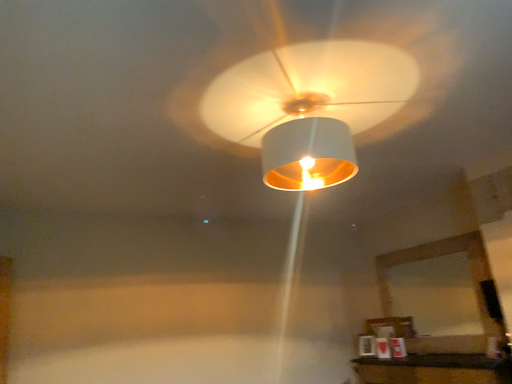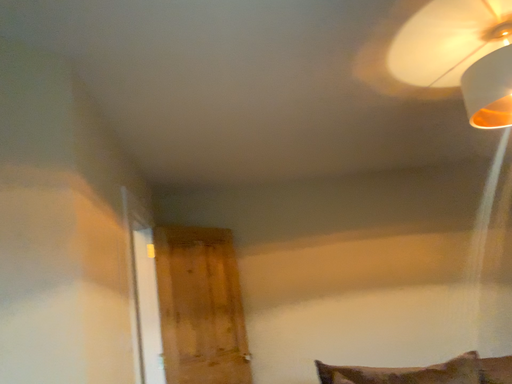
Question: How did the camera likely rotate when shooting the video?

Choices:
 (A) rotated upward
 (B) rotated downward

Answer: (B)